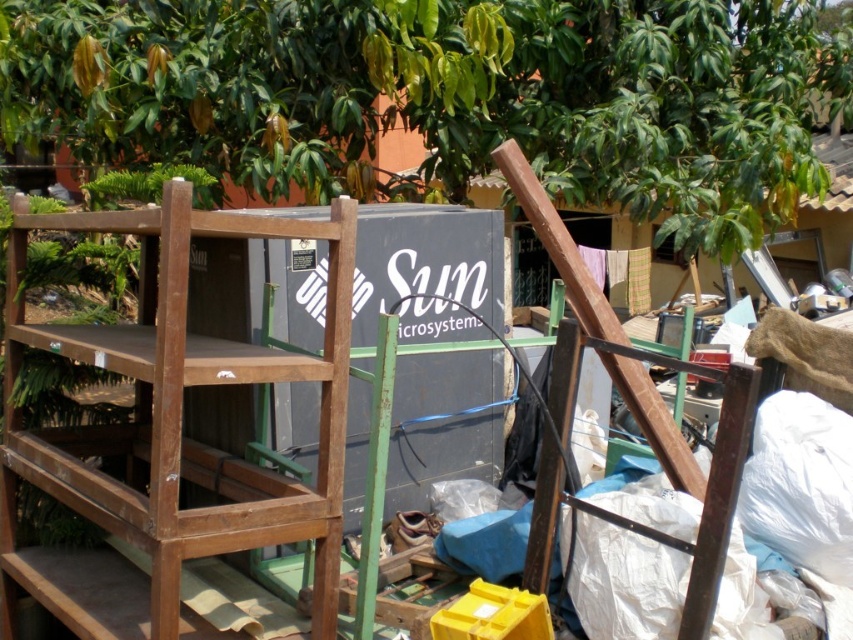
Question: Which point is closer to the camera?

Choices:
 (A) brown wooden bunk bed at center
 (B) wooden at right

Answer: (B)

Question: Is brown wooden bunk bed at center to the left of wooden shelf at left from the viewer's perspective?

Choices:
 (A) no
 (B) yes

Answer: (A)

Question: Can you confirm if green leafy tree at upper center is smaller than wooden at right?

Choices:
 (A) yes
 (B) no

Answer: (B)

Question: Can you confirm if wooden shelf at left is positioned to the left of wooden at right?

Choices:
 (A) no
 (B) yes

Answer: (B)

Question: Estimate the real-world distances between objects in this image. Which object is farther from the wooden shelf at left?

Choices:
 (A) brown wooden bunk bed at center
 (B) green leafy tree at upper center

Answer: (B)

Question: Considering the real-world distances, which object is closest to the green leafy tree at upper center?

Choices:
 (A) wooden shelf at left
 (B) brown wooden bunk bed at center
 (C) wooden at right

Answer: (A)